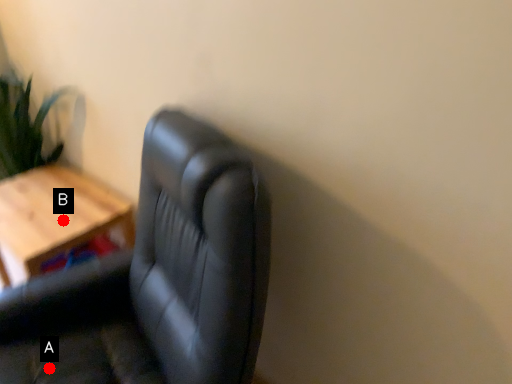
Question: Two points are circled on the image, labeled by A and B beside each circle. Which point appears closest to the camera in this image?

Choices:
 (A) A is closer
 (B) B is closer

Answer: (A)